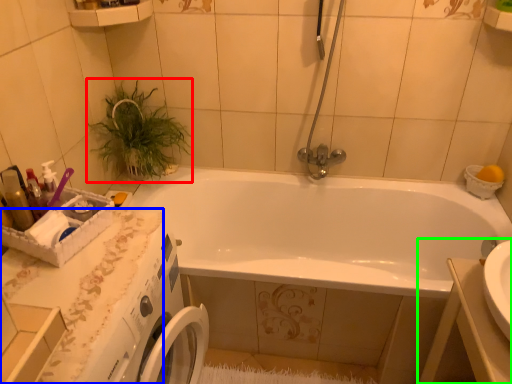
Question: Which is nearer to the plant (highlighted by a red box)? counter top (highlighted by a blue box) or sink (highlighted by a green box).

Choices:
 (A) counter top
 (B) sink

Answer: (A)